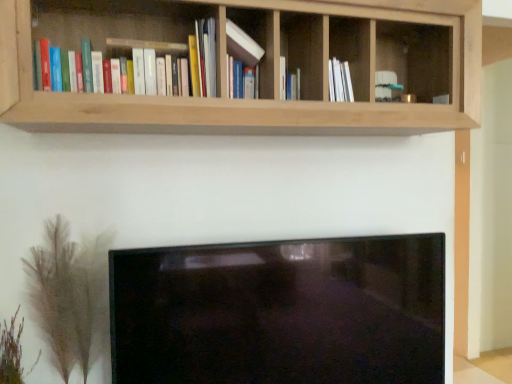
Question: Is green feathery plant at lower left, which ranks as the first plant in left-to-right order, at the right side of natural wood shelf at upper center?

Choices:
 (A) no
 (B) yes

Answer: (A)

Question: From a real-world perspective, does green feathery plant at lower left, which appears as the 2th plant when viewed from the right, sit lower than natural wood shelf at upper center?

Choices:
 (A) yes
 (B) no

Answer: (A)

Question: Considering the relative positions of green feathery plant at lower left, which ranks as the first plant in left-to-right order, and natural wood shelf at upper center in the image provided, is green feathery plant at lower left, which ranks as the first plant in left-to-right order, behind natural wood shelf at upper center?

Choices:
 (A) no
 (B) yes

Answer: (B)

Question: Is green feathery plant at lower left, which appears as the 2th plant when viewed from the right, directly adjacent to natural wood shelf at upper center?

Choices:
 (A) no
 (B) yes

Answer: (A)

Question: Is green feathery plant at lower left, which ranks as the first plant in left-to-right order, facing towards natural wood shelf at upper center?

Choices:
 (A) yes
 (B) no

Answer: (B)

Question: In the image, is hardcover books at upper left, the 1th book viewed from the left, positioned in front of or behind matte white book at center, which ranks as the 2th book in left-to-right order?

Choices:
 (A) behind
 (B) front

Answer: (B)

Question: Considering the positions of point (80, 18) and point (249, 48), is point (80, 18) closer or farther from the camera than point (249, 48)?

Choices:
 (A) closer
 (B) farther

Answer: (B)

Question: Which is correct: hardcover books at upper left, which is the second book in right-to-left order, is inside matte white book at center, which ranks as the 2th book in left-to-right order, or outside of it?

Choices:
 (A) outside
 (B) inside

Answer: (A)

Question: Considering the positions of hardcover books at upper left, which is the second book in right-to-left order, and matte white book at center, which ranks as the 2th book in left-to-right order, in the image, is hardcover books at upper left, which is the second book in right-to-left order, bigger or smaller than matte white book at center, which ranks as the 2th book in left-to-right order,?

Choices:
 (A) small
 (B) big

Answer: (B)

Question: Based on their sizes in the image, would you say green feathery plant at lower left, which appears as the 2th plant when viewed from the right, is bigger or smaller than hardcover books at upper left, which is the second book in right-to-left order?

Choices:
 (A) big
 (B) small

Answer: (B)

Question: From a real-world perspective, relative to hardcover books at upper left, the 1th book viewed from the left, is green feathery plant at lower left, which ranks as the first plant in left-to-right order, vertically above or below?

Choices:
 (A) below
 (B) above

Answer: (A)

Question: Does point pyautogui.click(x=19, y=349) appear closer or farther from the camera than point pyautogui.click(x=207, y=76)?

Choices:
 (A) farther
 (B) closer

Answer: (A)

Question: From their relative heights in the image, would you say green feathery plant at lower left, which ranks as the first plant in left-to-right order, is taller or shorter than hardcover books at upper left, the 1th book viewed from the left?

Choices:
 (A) short
 (B) tall

Answer: (A)

Question: Considering their positions, is green feathery plant at lower left, which ranks as the first plant in left-to-right order, located in front of or behind matte white book at center, which ranks as the 2th book in left-to-right order?

Choices:
 (A) front
 (B) behind

Answer: (A)

Question: Would you say green feathery plant at lower left, which ranks as the first plant in left-to-right order, is inside or outside matte white book at center, which is the first book from right to left?

Choices:
 (A) inside
 (B) outside

Answer: (B)